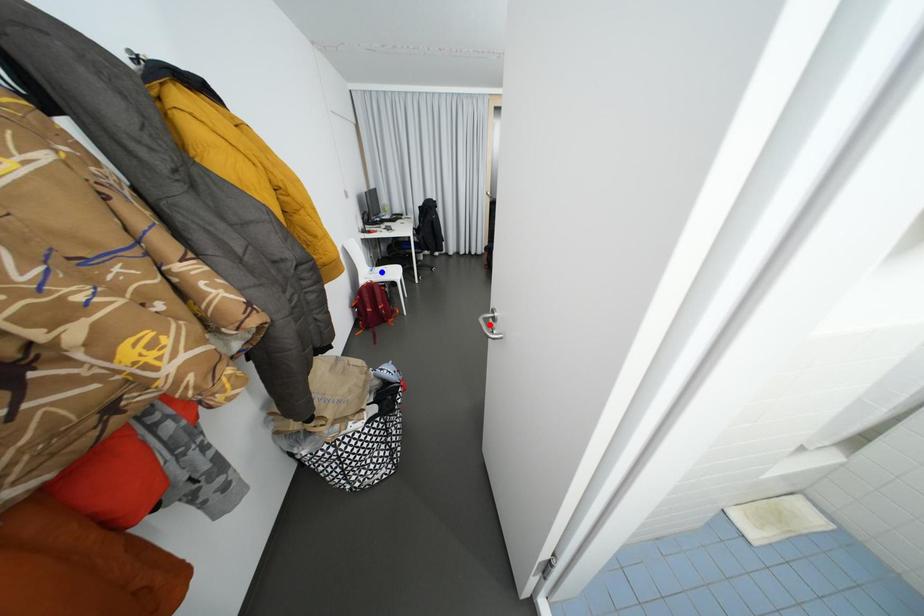
Question: In the image, two points are highlighted. Which point is nearer to the camera? Reply with the corresponding letter.

Choices:
 (A) blue point
 (B) red point

Answer: (B)